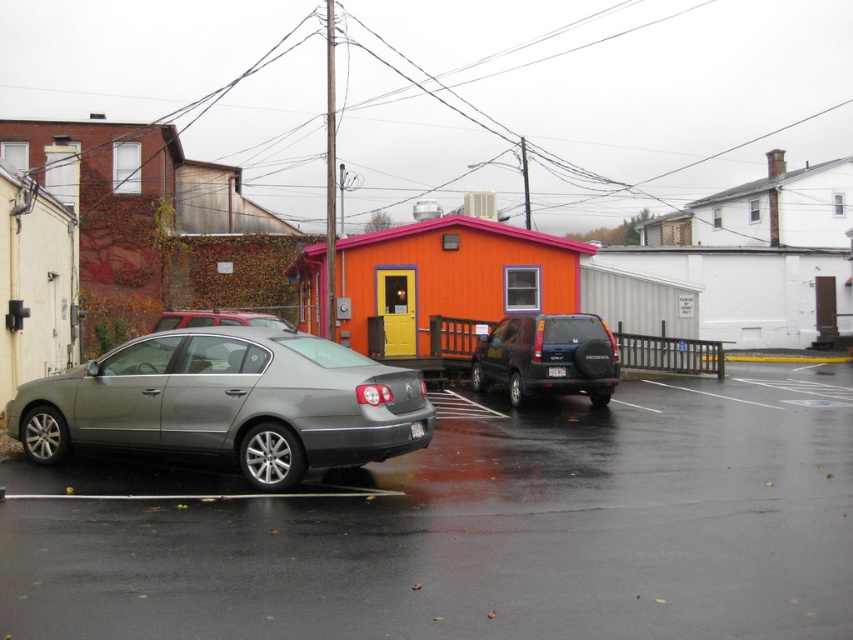
Question: Which is nearer to the orange matte/hardobject at upper center?

Choices:
 (A) orange matte/hardobject at center
 (B) orange matte building at center

Answer: (A)

Question: Which object is farther from the camera taking this photo?

Choices:
 (A) orange matte/hardobject at center
 (B) orange matte/hardobject at upper center
 (C) white matte house at upper right
 (D) satin silver car at lower left

Answer: (C)

Question: Observing the image, what is the correct spatial positioning of white matte building at upper right in reference to orange matte/hardobject at center?

Choices:
 (A) above
 (B) below

Answer: (A)

Question: Does satin silver car at lower left lie behind satin silver sedan at lower left?

Choices:
 (A) yes
 (B) no

Answer: (B)

Question: Which point is farther to the camera?

Choices:
 (A) orange matte/hardobject at center
 (B) white matte house at upper right
 (C) satin silver sedan at lower left
 (D) white matte building at upper right

Answer: (B)

Question: Does satin silver sedan at lower left have a lesser width compared to white matte building at upper right?

Choices:
 (A) no
 (B) yes

Answer: (B)